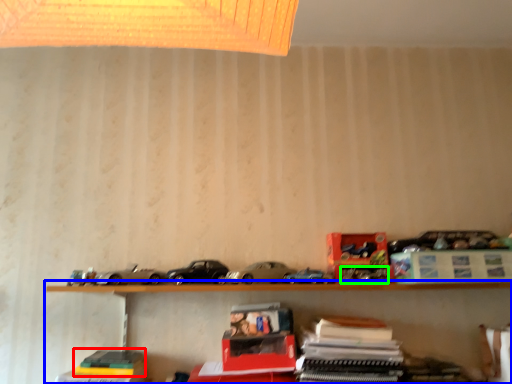
Question: Which is farther away from book (highlighted by a red box)? shelf (highlighted by a blue box) or toy (highlighted by a green box)?

Choices:
 (A) shelf
 (B) toy

Answer: (B)